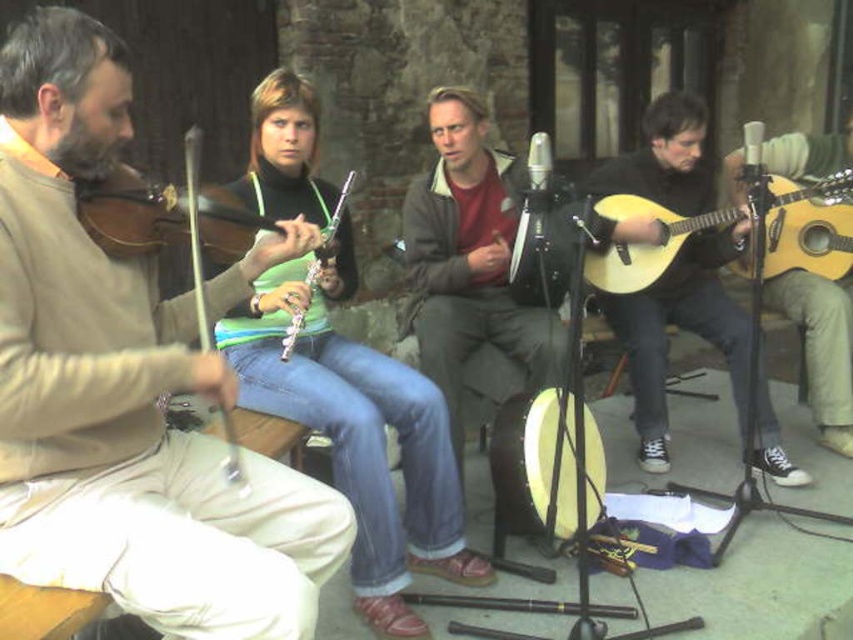
Question: Does light brown acoustic guitar at right have a lesser width compared to matte brown violin at center?

Choices:
 (A) no
 (B) yes

Answer: (A)

Question: Among these points, which one is nearest to the camera?

Choices:
 (A) (103, 365)
 (B) (103, 179)
 (C) (701, 224)

Answer: (A)

Question: Is light brown acoustic guitar at right thinner than wooden violin at center?

Choices:
 (A) yes
 (B) no

Answer: (B)

Question: Can you confirm if light wood acoustic guitar at right is smaller than matte brown violin at center?

Choices:
 (A) yes
 (B) no

Answer: (B)

Question: Which point is closer to the camera?

Choices:
 (A) light wood acoustic guitar at right
 (B) wooden violin at center
 (C) wooden violin at left
 (D) green fabric shirt at center

Answer: (B)

Question: Among these points, which one is nearest to the camera?

Choices:
 (A) (631, 317)
 (B) (45, 40)

Answer: (B)